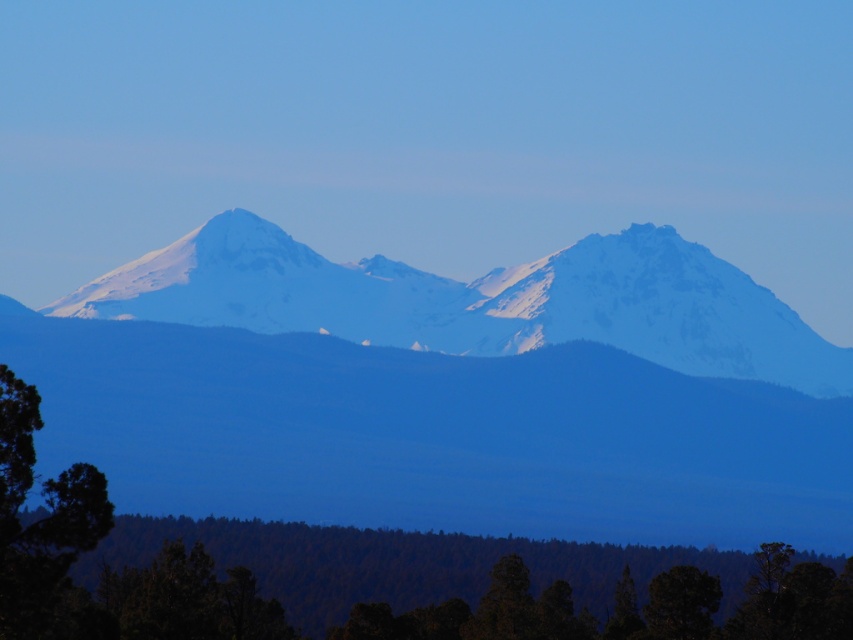
Question: Based on their relative distances, which object is nearer to the green leafy tree at lower left?

Choices:
 (A) green matte tree at lower center
 (B) white snow-covered mountain range at center

Answer: (B)

Question: Is white snow-covered mountain range at center positioned in front of green matte tree at lower center?

Choices:
 (A) yes
 (B) no

Answer: (B)

Question: Can you confirm if green leafy tree at lower left is positioned to the right of green matte tree at lower center?

Choices:
 (A) yes
 (B) no

Answer: (B)

Question: Where is green leafy tree at lower left located in relation to green matte tree at lower center in the image?

Choices:
 (A) right
 (B) left

Answer: (B)

Question: Which of the following is the closest to the observer?

Choices:
 (A) white snow-covered mountain range at center
 (B) green leafy tree at lower left

Answer: (B)

Question: Considering the real-world distances, which object is farthest from the green matte tree at lower center?

Choices:
 (A) green leafy tree at lower left
 (B) white snow-covered mountain range at center

Answer: (A)